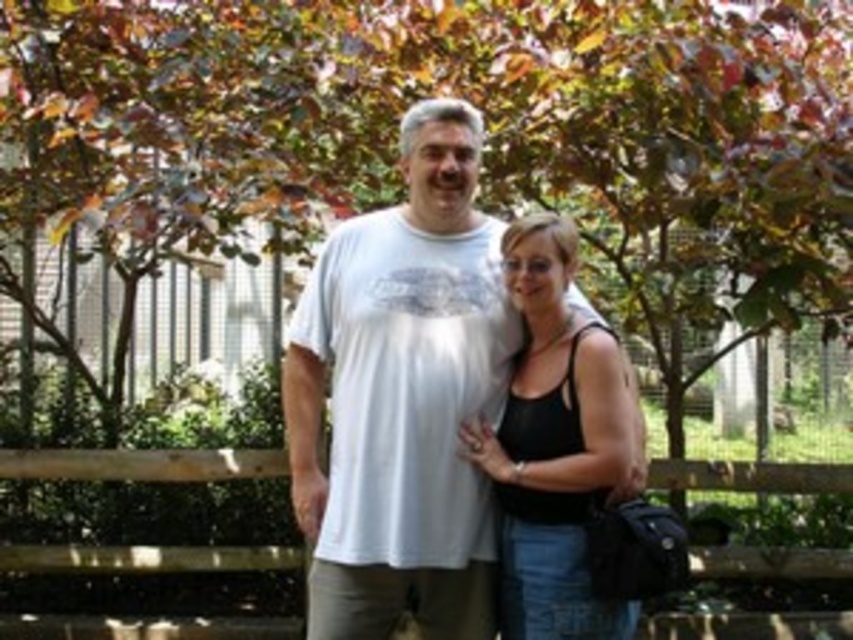
Question: Is white cotton t-shirt at center below black matte tank top at center?

Choices:
 (A) yes
 (B) no

Answer: (B)

Question: Is white cotton t-shirt at center smaller than black matte tank top at center?

Choices:
 (A) yes
 (B) no

Answer: (B)

Question: Is white cotton t-shirt at center to the left of black matte tank top at center from the viewer's perspective?

Choices:
 (A) yes
 (B) no

Answer: (A)

Question: Which of the following is the farthest from the observer?

Choices:
 (A) (469, 216)
 (B) (521, 499)

Answer: (A)